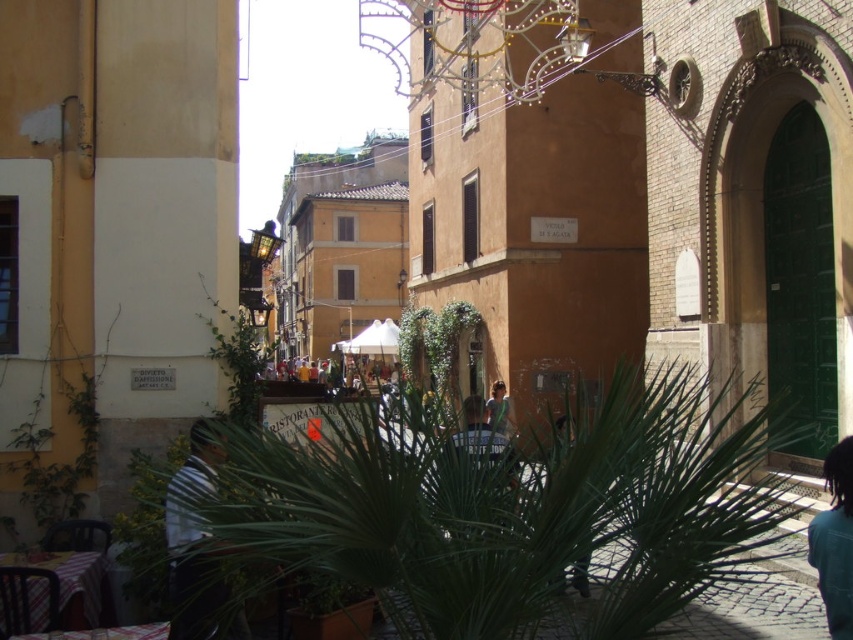
You are standing on the cobblestone street in the historic town and see the green leafy palm tree at center and the black hair at lower right. Which object is nearer to you?

The green leafy palm tree at center is closer to the viewer than the black hair at lower right.

You are a photographer trying to capture a shot of the green leafy palm tree at center and the light brown leather jacket at center. Which object would you need to frame more tightly in your camera to ensure it fits within the shot?

The green leafy palm tree at center has a lesser width compared to the light brown leather jacket at center, so you would need to frame the light brown leather jacket at center more tightly to ensure it fits within the shot.

You are a tourist standing on the cobblestone street in front of the historic buildings. You want to take a photo of the light brown leather jacket at center without the green leafy palm tree at center blocking the view. Where should you move to achieve this?

Move behind the green leafy palm tree at center so that the light brown leather jacket at center is visible without obstruction.